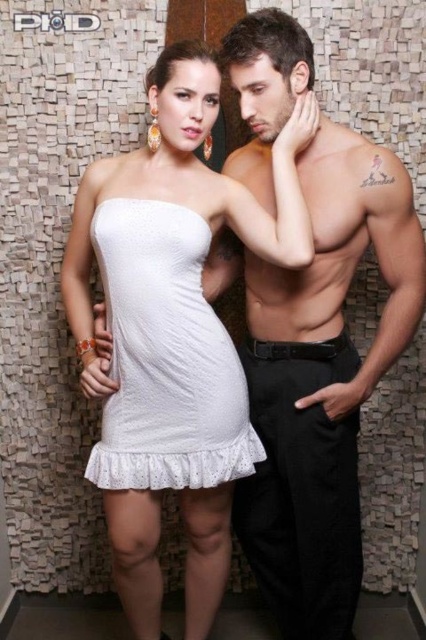
Question: Which point appears closest to the camera in this image?

Choices:
 (A) (175, 451)
 (B) (172, 472)

Answer: (A)

Question: Can you confirm if white lace dress at center is positioned below white lace underwear at lower center?

Choices:
 (A) yes
 (B) no

Answer: (B)

Question: Is white lace dress at center wider than white lace underwear at lower center?

Choices:
 (A) no
 (B) yes

Answer: (A)

Question: Which object is farther from the camera taking this photo?

Choices:
 (A) white lace underwear at lower center
 (B) white lace dress at center

Answer: (A)

Question: Is white lace dress at center to the left of white lace underwear at lower center from the viewer's perspective?

Choices:
 (A) no
 (B) yes

Answer: (B)

Question: Which point appears farthest from the camera in this image?

Choices:
 (A) (183, 444)
 (B) (141, 476)

Answer: (B)